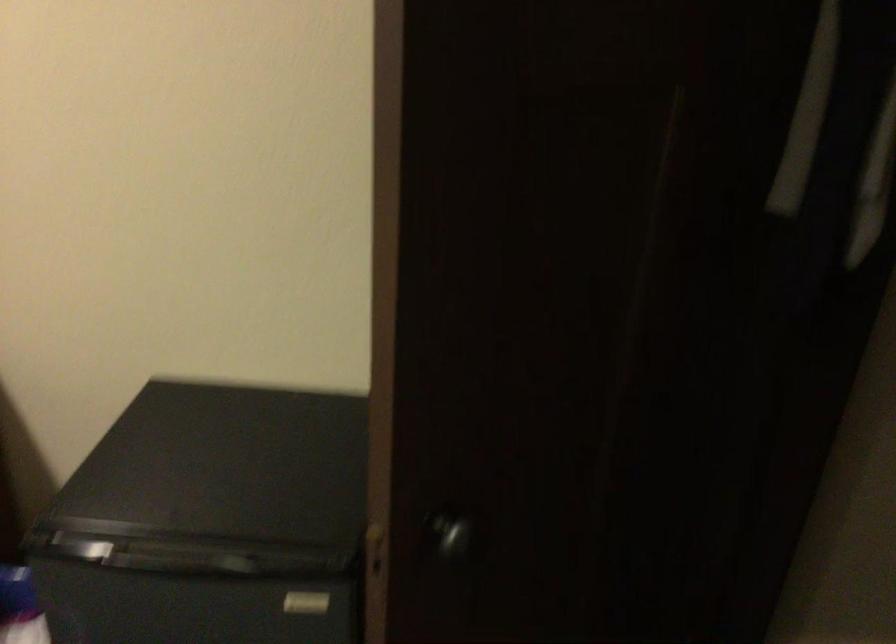
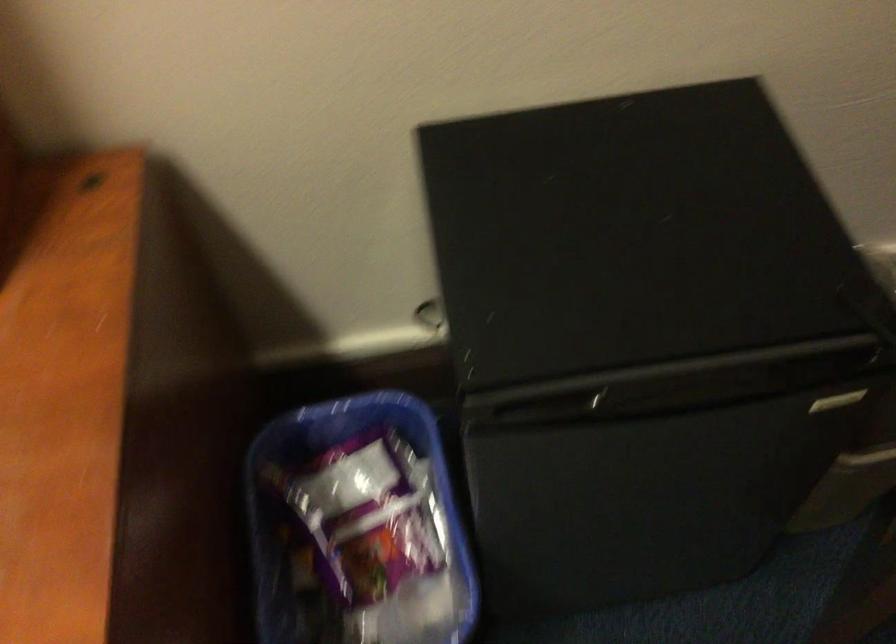
Which direction would the cameraman need to move to produce the second image?

The cameraman moved toward left, forward.